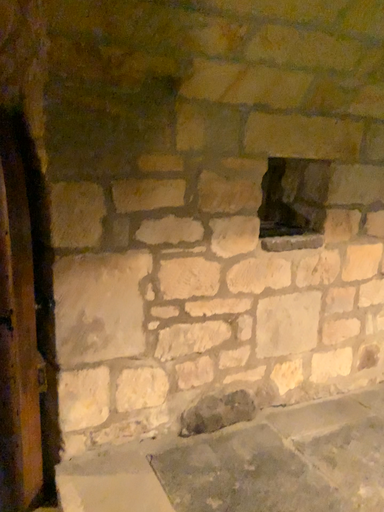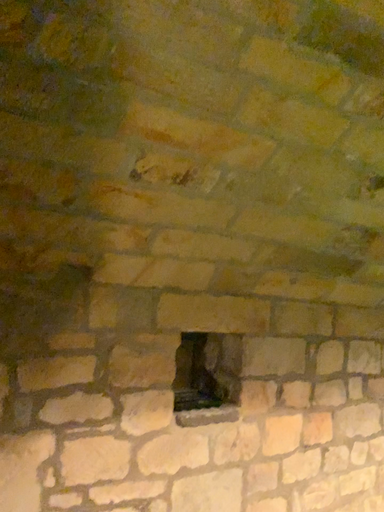
Question: How did the camera likely rotate when shooting the video?

Choices:
 (A) rotated upward
 (B) rotated downward

Answer: (A)